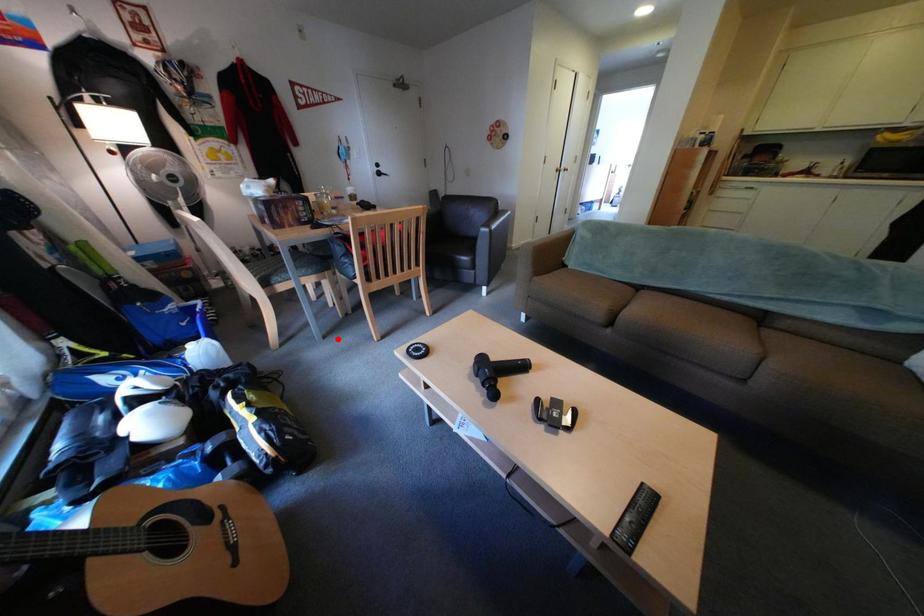
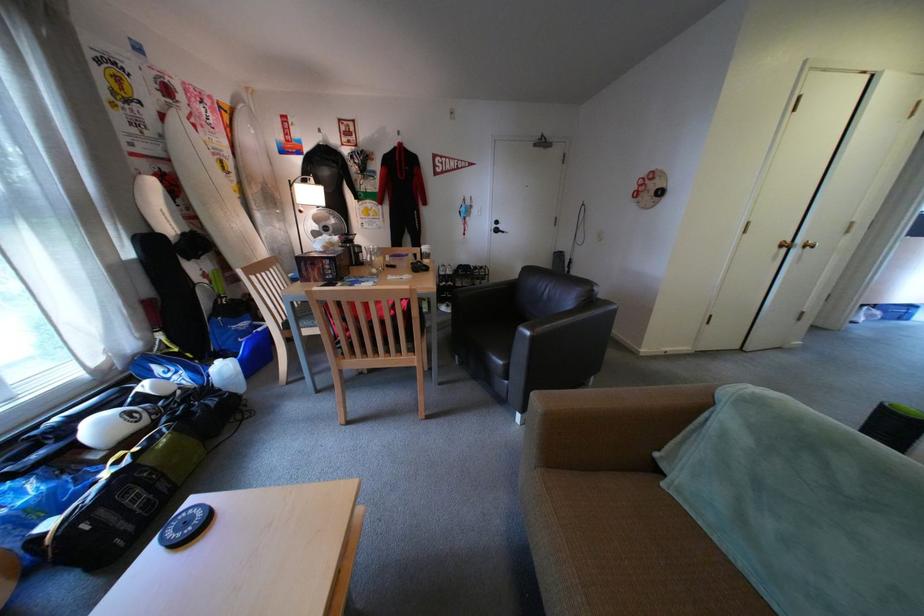
Where in the second image is the point corresponding to the highlighted location from the first image?

(333, 392)